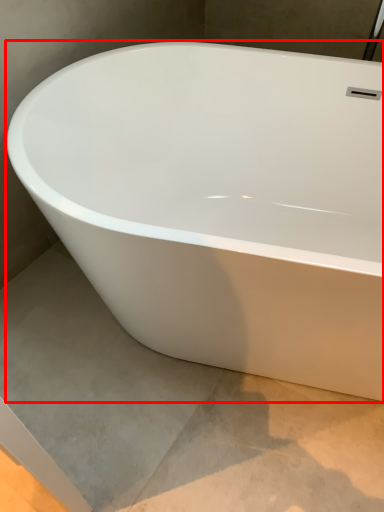
Question: From the image's perspective, where is bathtub (annotated by the red box) located in relation to concrete in the image?

Choices:
 (A) below
 (B) above

Answer: (B)